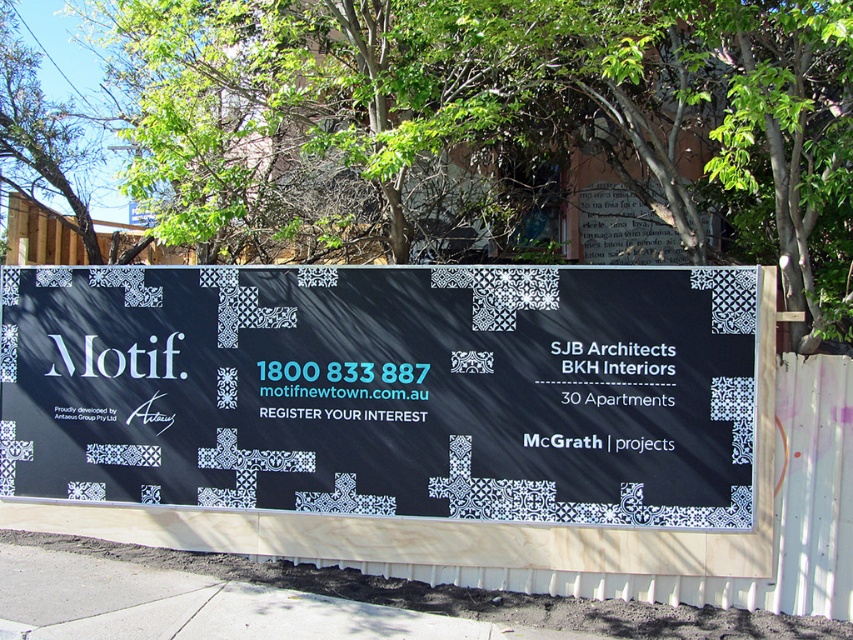
You are standing at the construction site and want to take a photo of the advertisement banner. You notice two points marked on the banner at coordinates point (189, 396) and point (357, 573). Which point is closer to your camera lens?

Point (189, 396) is further to the viewer than point (357, 573), so the point closer to the camera lens would be point (357, 573) since it is farther from the viewer.

You are a pedestrian looking at the construction site. You see a green leafy tree at upper center and a concrete pavement at lower center. Which object is closer to you?

The green leafy tree at upper center is closer to you because it is in front of the concrete pavement at lower center.